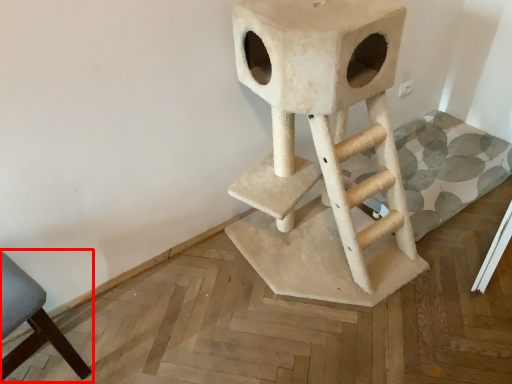
Question: From the image, what is the correct spatial relationship of chair (annotated by the red box) in relation to bar stool?

Choices:
 (A) right
 (B) left

Answer: (B)